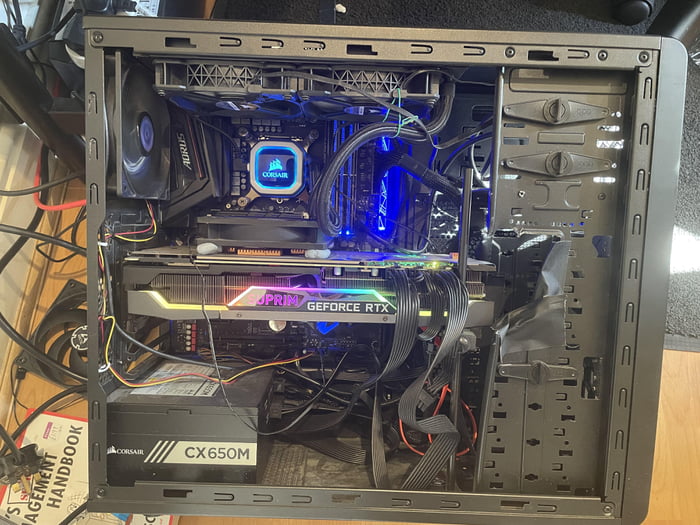
Identify the location of book on floor. (78, 418).